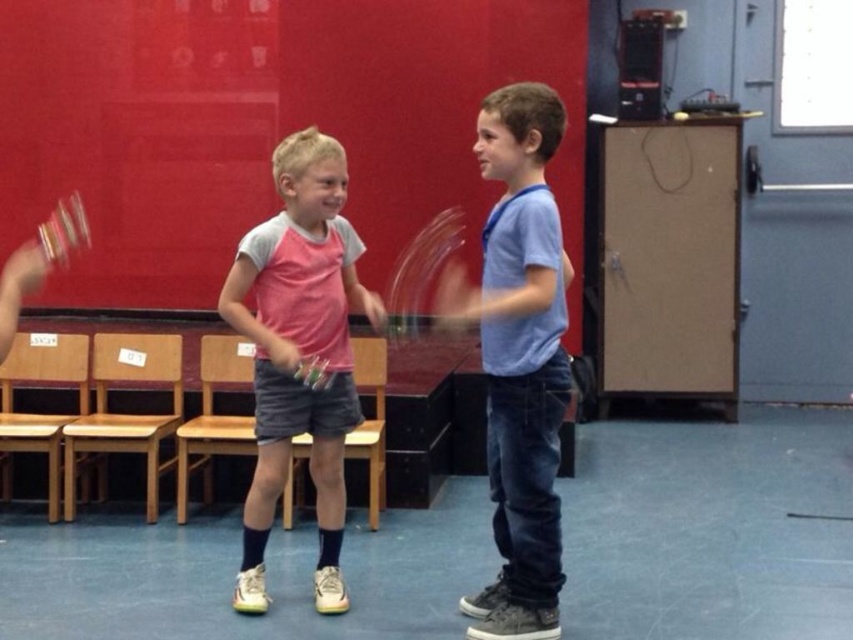
Which is below, pink fabric shirt at center or clear plastic tennis racket at center?

pink fabric shirt at center is lower down.

How far apart are pink fabric shirt at center and clear plastic tennis racket at center?

The distance of pink fabric shirt at center from clear plastic tennis racket at center is 9.65 feet.

This screenshot has width=853, height=640. Describe the element at coordinates (299, 352) in the screenshot. I see `pink fabric shirt at center` at that location.

Where is `pink fabric shirt at center`? Image resolution: width=853 pixels, height=640 pixels. pink fabric shirt at center is located at coordinates (299, 352).

Can you confirm if clear plastic tennis racket at center is bigger than clear plastic tennis racket at left?

Correct, clear plastic tennis racket at center is larger in size than clear plastic tennis racket at left.

Which is above, clear plastic tennis racket at center or clear plastic tennis racket at left?

Positioned higher is clear plastic tennis racket at left.

Who is more forward, (395,300) or (41,237)?

Point (395,300) is more forward.

This screenshot has width=853, height=640. What are the coordinates of `clear plastic tennis racket at center` in the screenshot? It's located at (421, 275).

Which is more to the right, blue denim jeans at center or clear plastic tennis racket at center?

blue denim jeans at center

Does blue denim jeans at center appear under clear plastic tennis racket at center?

Indeed, blue denim jeans at center is positioned under clear plastic tennis racket at center.

This screenshot has height=640, width=853. What do you see at coordinates (518, 358) in the screenshot?
I see `blue denim jeans at center` at bounding box center [518, 358].

You are a GUI agent. You are given a task and a screenshot of the screen. Output one action in this format:
    pyautogui.click(x=<x>, y=<y>)
    Task: Click on the blue denim jeans at center
    The height and width of the screenshot is (640, 853).
    Given the screenshot: What is the action you would take?
    pyautogui.click(x=518, y=358)